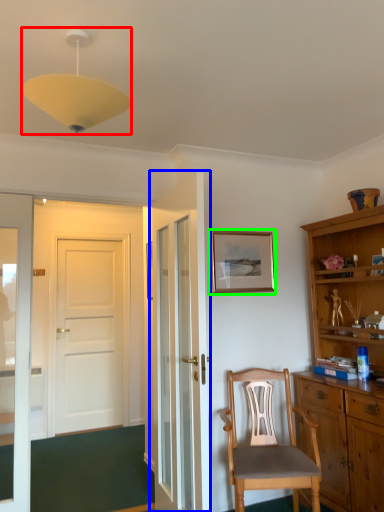
Question: Estimate the real-world distances between objects in this image. Which object is closer to light fixture (highlighted by a red box), door (highlighted by a blue box) or picture frame (highlighted by a green box)?

Choices:
 (A) door
 (B) picture frame

Answer: (A)